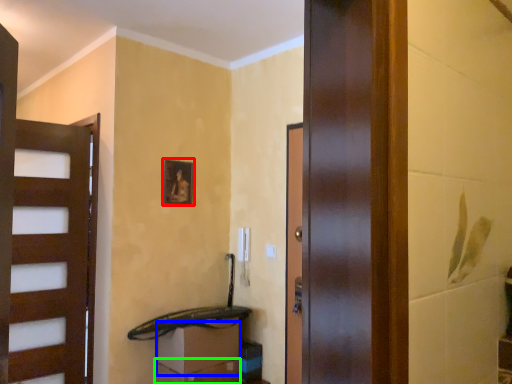
Question: Which is farther away from picture frame (highlighted by a red box)? drawer (highlighted by a blue box) or drawer (highlighted by a green box)?

Choices:
 (A) drawer
 (B) drawer

Answer: (B)